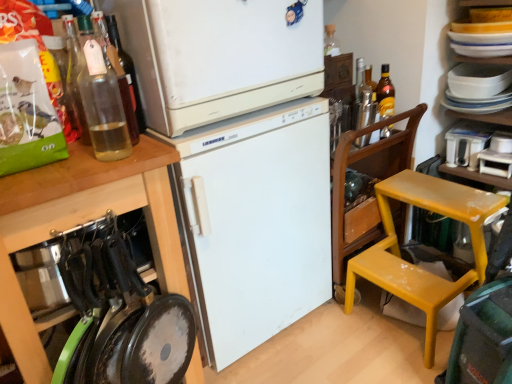
Locate an element on the screen. This screenshot has width=512, height=384. empty space that is ontop of yellow plastic chair at right (from a real-world perspective) is located at coordinates (442, 202).